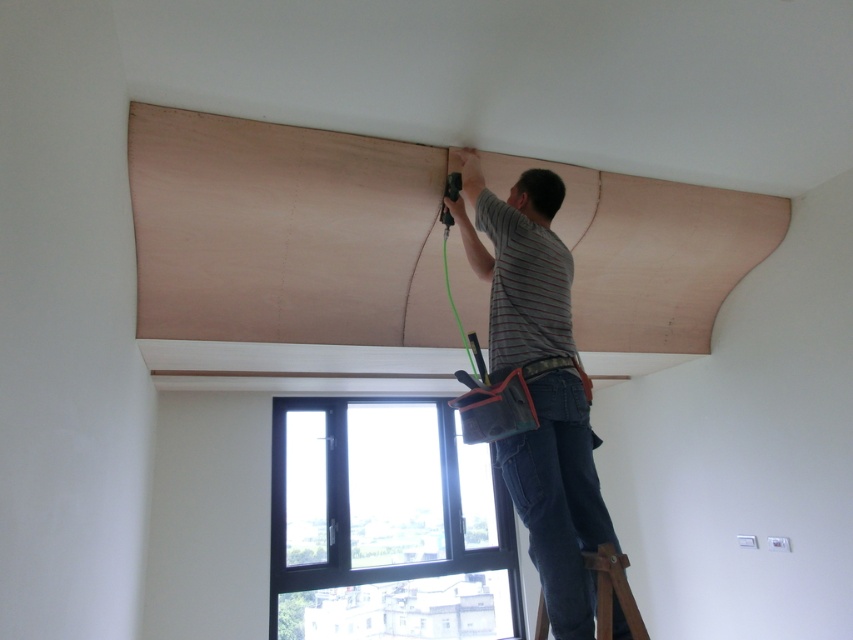
Image resolution: width=853 pixels, height=640 pixels. I want to click on clear glass window at center, so click(x=387, y=525).

I want to click on clear glass window at center, so click(387, 525).

Is striped cotton shirt at upper center in front of brown leather ladder at lower right?

No.

Looking at this image, can you confirm if striped cotton shirt at upper center is shorter than brown leather ladder at lower right?

In fact, striped cotton shirt at upper center may be taller than brown leather ladder at lower right.

Locate an element on the screen. striped cotton shirt at upper center is located at coordinates (538, 385).

Is point (463, 552) farther from camera compared to point (619, 616)?

Yes, it is behind point (619, 616).

This screenshot has width=853, height=640. What are the coordinates of `clear glass window at center` in the screenshot? It's located at (387, 525).

Image resolution: width=853 pixels, height=640 pixels. What are the coordinates of `clear glass window at center` in the screenshot? It's located at (387, 525).